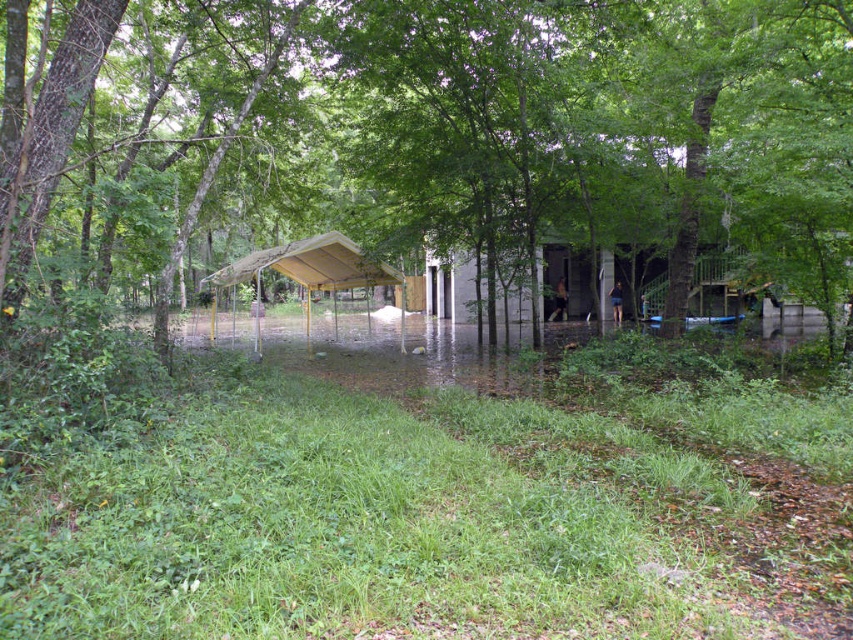
Can you confirm if brown wood tree at center is bigger than yellow metal carport at center?

Indeed, brown wood tree at center has a larger size compared to yellow metal carport at center.

Does brown wood tree at center appear on the left side of yellow metal carport at center?

In fact, brown wood tree at center is to the right of yellow metal carport at center.

Is point (524, 228) positioned in front of point (321, 284)?

Yes, point (524, 228) is closer to viewer.

Locate an element on the screen. brown wood tree at center is located at coordinates (550, 125).